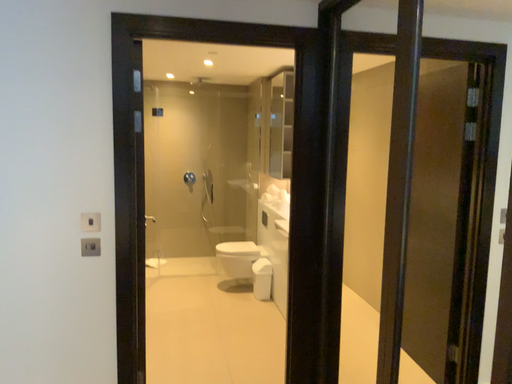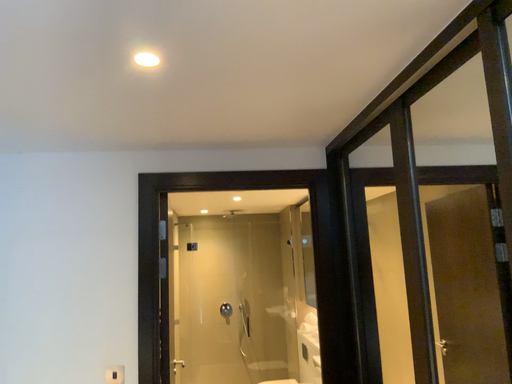
Question: How did the camera likely rotate when shooting the video?

Choices:
 (A) rotated upward
 (B) rotated downward

Answer: (A)